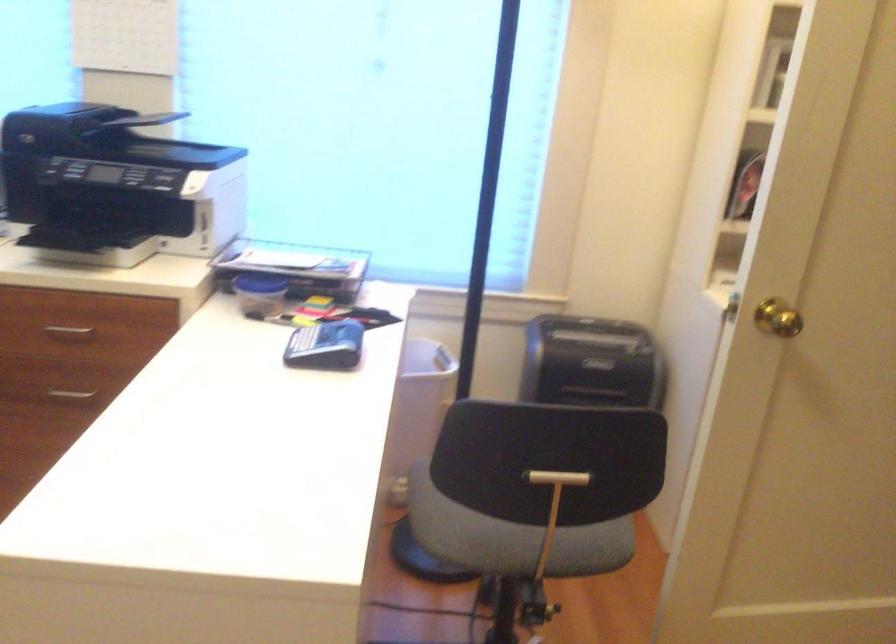
The width and height of the screenshot is (896, 644). I want to click on chair back handle, so click(x=535, y=495).